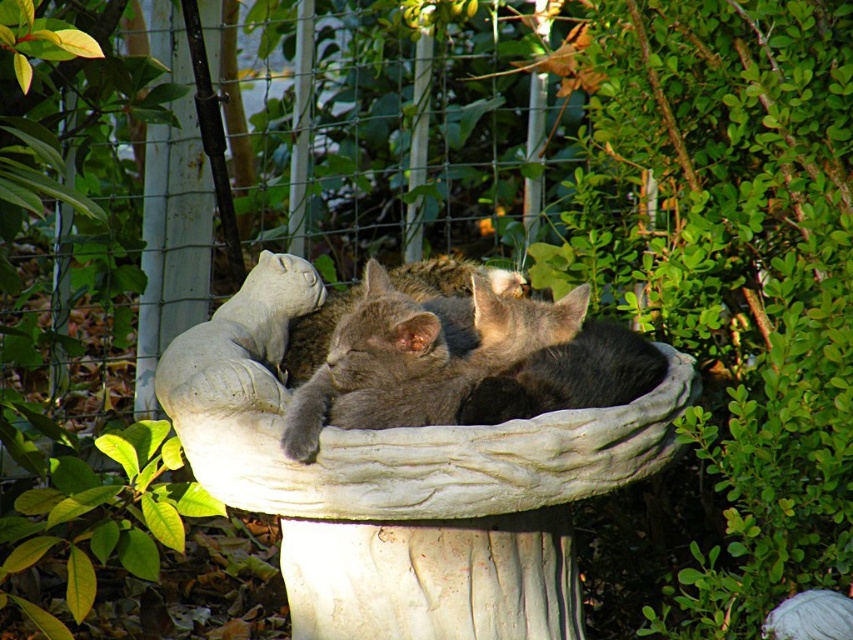
Question: Which point is farther to the camera?

Choices:
 (A) gray soft fur cat at center
 (B) white stone bowl at center
 (C) metallic wire fence at upper center

Answer: (C)

Question: Is white stone bowl at center thinner than gray soft fur cat at center?

Choices:
 (A) no
 (B) yes

Answer: (A)

Question: Is the position of metallic wire fence at upper center less distant than that of gray soft fur cat at center?

Choices:
 (A) yes
 (B) no

Answer: (B)

Question: Is metallic wire fence at upper center to the right of gray soft fur cat at center from the viewer's perspective?

Choices:
 (A) no
 (B) yes

Answer: (A)

Question: Among these objects, which one is nearest to the camera?

Choices:
 (A) white stone bowl at center
 (B) gray soft fur cat at center
 (C) metallic wire fence at upper center

Answer: (B)

Question: Which object is positioned closest to the gray soft fur cat at center?

Choices:
 (A) white stone bowl at center
 (B) metallic wire fence at upper center

Answer: (A)